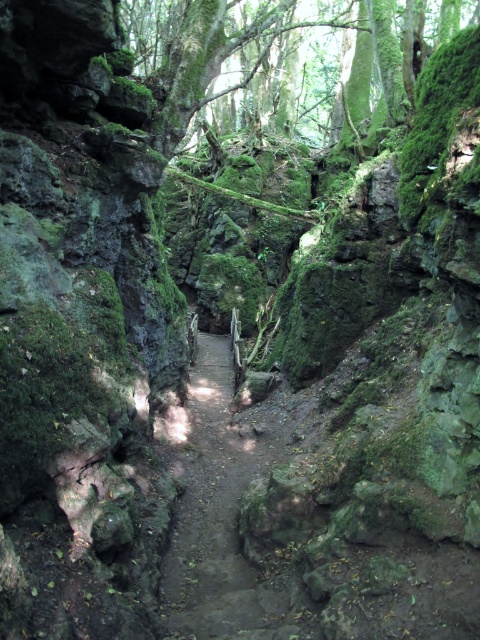
You are a hiker carrying a 1.5 meter long backpack. You need to pass through the narrow canyon and want to know if your backpack will fit between the dirt path at center and the green mossy tree at upper center. Can you confirm the distance allows it?

The dirt path at center and the green mossy tree at upper center are 16.31 meters apart, so yes, the backpack will fit since the distance is much larger than the backpack length.

You are a hiker trying to navigate through the canyon. You see a dirt path at center and a green mossy tree at upper center. Which object is positioned higher in the scene?

The green mossy tree at upper center is positioned higher than the dirt path at center.